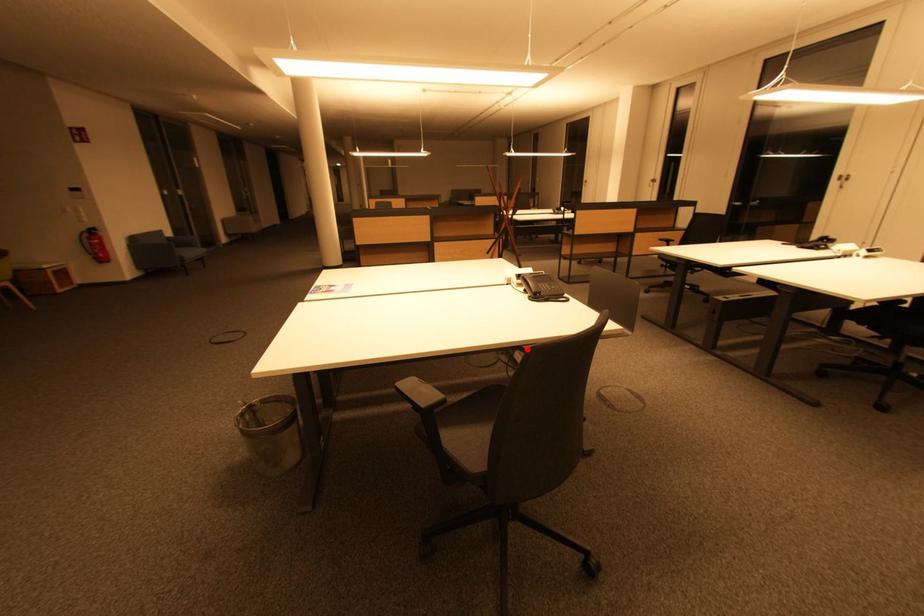
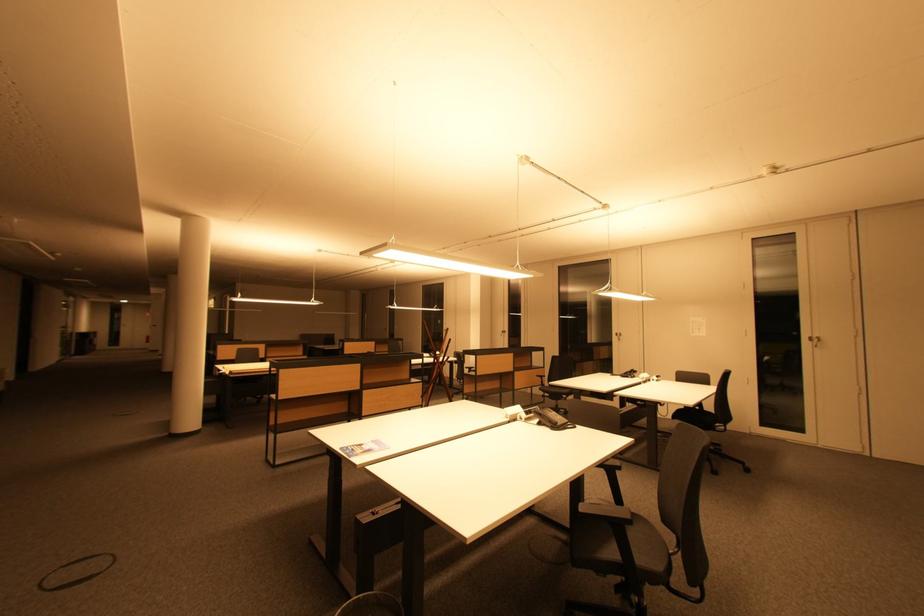
Find the pixel in the second image that matches the highlighted location in the first image.

(610, 466)